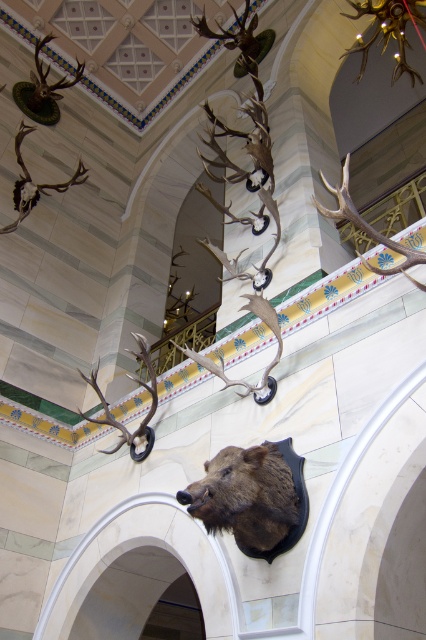
You are an interior designer assessing the museum layout. You need to install a new spotlight above the shiny silver antlers at upper left and the shiny brown antlers at upper left. Which antlers should the spotlight be placed above to avoid casting a shadow on the other?

The shiny silver antlers at upper left is located below the shiny brown antlers at upper left. To avoid casting a shadow, the spotlight should be placed above the shiny brown antlers at upper left since it is higher up and will not cast a shadow on the lower shiny silver antlers at upper left.

You are an interior designer planning to hang a new artwork between the brown furry head at center and the shiny brown antlers at center. Since both are at the center, how can you determine where to place the new artwork?

The brown furry head at center is shorter than the shiny brown antlers at center, so you should place the new artwork above the brown furry head at center to maintain visual balance between the two objects.

In the scene shown: You are an art conservator examining the mounted deer heads in the museum. You notice two sets of antlers on the upper left wall. Which set of antlers, the shiny silver antlers at upper left or the shiny brown antlers at upper left, is positioned closer to the entrance of the museum?

The shiny silver antlers at upper left are closer to the viewer than the shiny brown antlers at upper left, so the shiny silver antlers at upper left are positioned closer to the entrance of the museum.